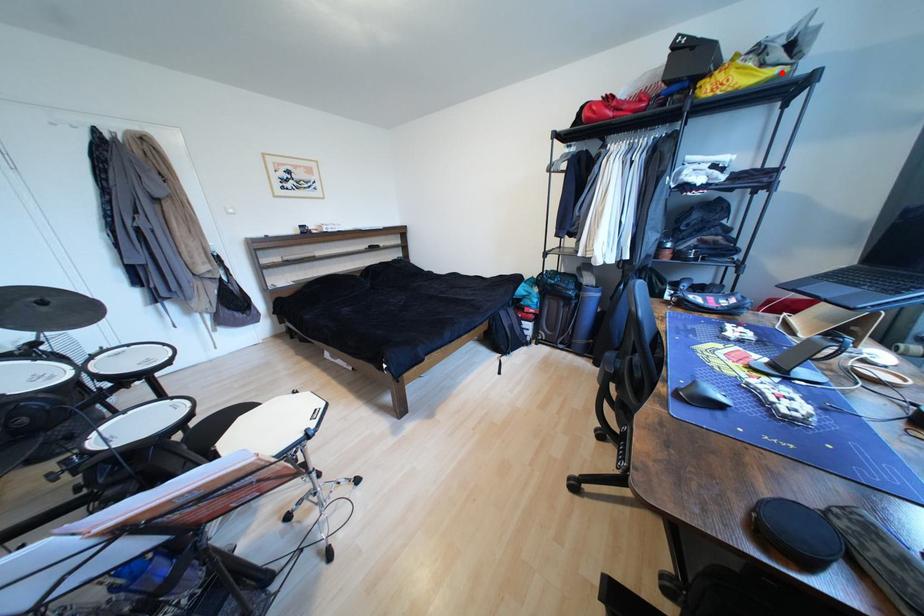
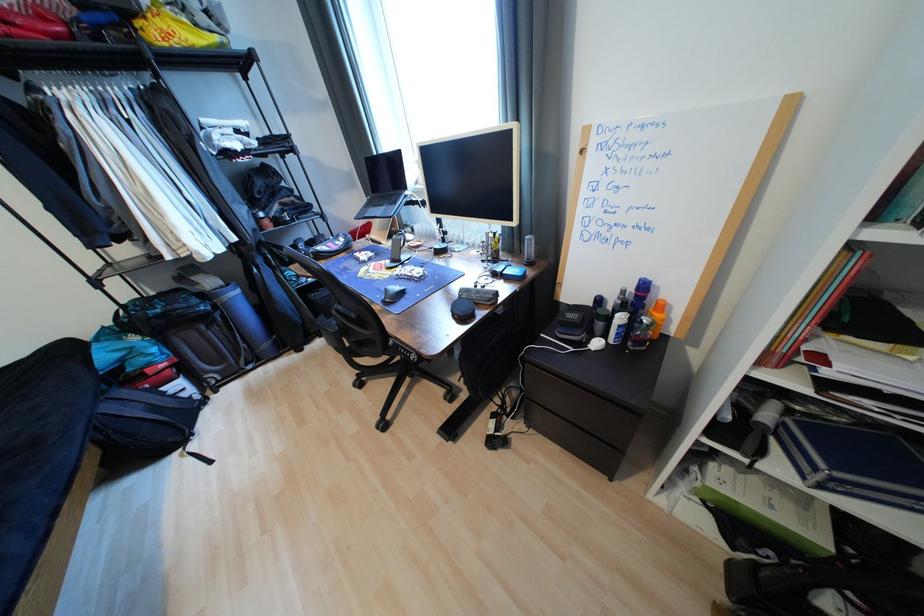
The point at the highlighted location is marked in the first image. Where is the corresponding point in the second image?

(223, 39)